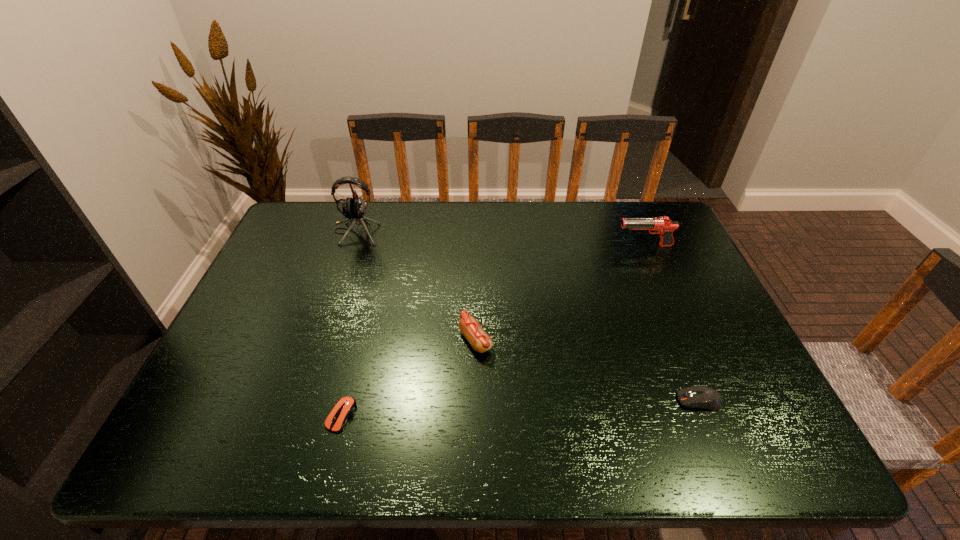
The width and height of the screenshot is (960, 540). Find the location of `earphone`. earphone is located at coordinates (354, 209).

In order to click on gun in this screenshot , I will do `click(663, 226)`.

I want to click on sausage, so click(x=480, y=341).

The image size is (960, 540). In order to click on the third shortest object in this screenshot , I will do `click(480, 341)`.

The width and height of the screenshot is (960, 540). What are the coordinates of `the second shortest object` in the screenshot? It's located at (704, 397).

Find the location of a particular element. the taller computer mouse is located at coordinates (704, 397).

Image resolution: width=960 pixels, height=540 pixels. I want to click on the left computer mouse, so click(x=345, y=407).

The height and width of the screenshot is (540, 960). Identify the location of the shortest object. (345, 407).

Where is `vacant space located on the right of the tallest object`? The image size is (960, 540). vacant space located on the right of the tallest object is located at coordinates (487, 232).

At what (x,y) coordinates should I click in order to perform the action: click on free point located 0.400m at the aiming end of the second tallest object. Please return your answer as a coordinate pair (x, y). Image resolution: width=960 pixels, height=540 pixels. Looking at the image, I should click on (490, 246).